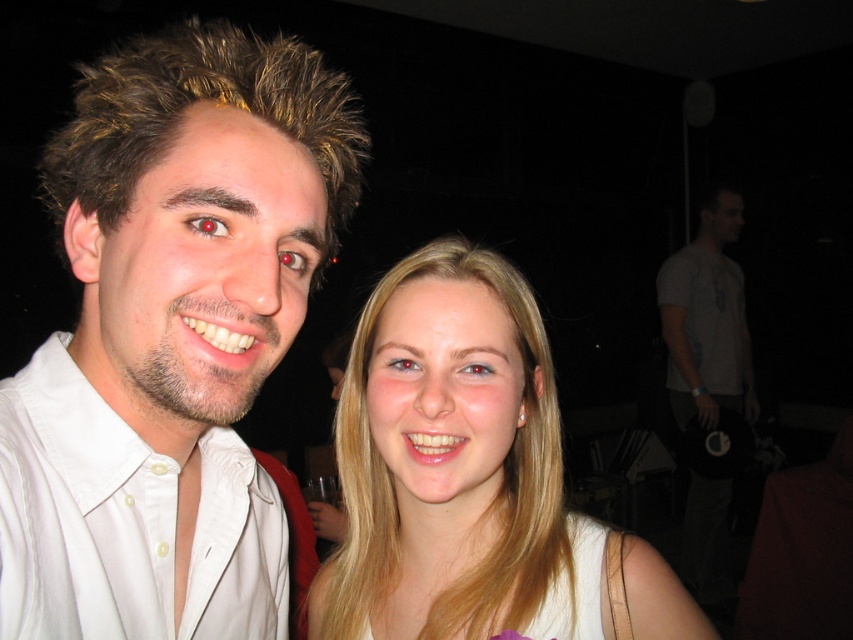
Question: Can you confirm if white cotton shirt at left is positioned to the left of gray cotton t-shirt at right?

Choices:
 (A) yes
 (B) no

Answer: (A)

Question: Which object is positioned farthest from the blonde hair at center?

Choices:
 (A) gray cotton t-shirt at right
 (B) white cotton shirt at left

Answer: (A)

Question: Is blonde hair at center thinner than white cotton shirt at left?

Choices:
 (A) yes
 (B) no

Answer: (B)

Question: Which object is farther from the camera taking this photo?

Choices:
 (A) gray cotton t-shirt at right
 (B) blonde hair at center
 (C) white cotton shirt at left

Answer: (A)

Question: Based on their relative distances, which object is farther from the blonde hair at center?

Choices:
 (A) white cotton shirt at left
 (B) gray cotton t-shirt at right

Answer: (B)

Question: Does blonde hair at center appear on the right side of white cotton shirt at left?

Choices:
 (A) yes
 (B) no

Answer: (A)